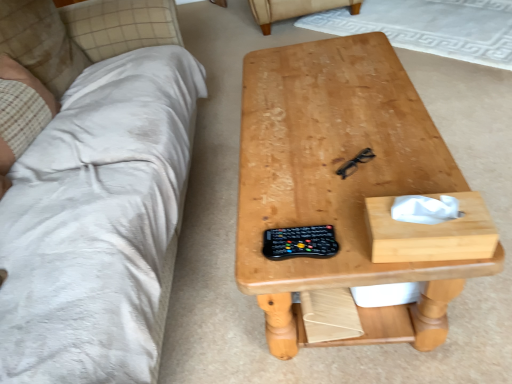
Find the location of a particular element. This screenshot has height=384, width=512. free spot behind black plastic remote at center is located at coordinates (295, 201).